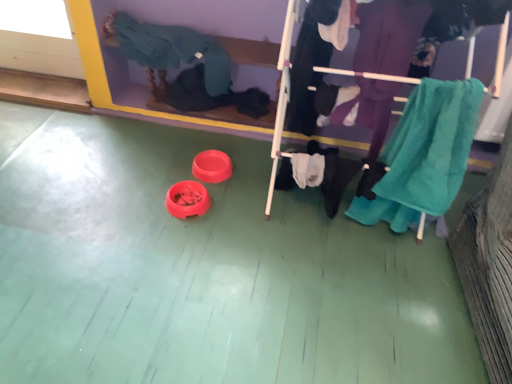
Question: Is teal fabric clothes rack at center bigger or smaller than teal towel at right, the third clothing viewed from the left?

Choices:
 (A) big
 (B) small

Answer: (A)

Question: Visually, is teal fabric clothes rack at center positioned to the left or to the right of teal towel at right, the third clothing viewed from the left?

Choices:
 (A) left
 (B) right

Answer: (A)

Question: Which of these objects is positioned farthest from the knitted teal sweater at upper left, the third clothing from the right?

Choices:
 (A) teal fabric clothes rack at center
 (B) teal towel at right, the third clothing viewed from the left
 (C) black cotton pants at center, which is counted as the 2th clothing, starting from the left

Answer: (B)

Question: Which of these objects is positioned farthest from the black cotton pants at center, which is counted as the 2th clothing, starting from the left?

Choices:
 (A) knitted teal sweater at upper left, the third clothing from the right
 (B) teal towel at right, the third clothing viewed from the left
 (C) teal fabric clothes rack at center

Answer: (A)